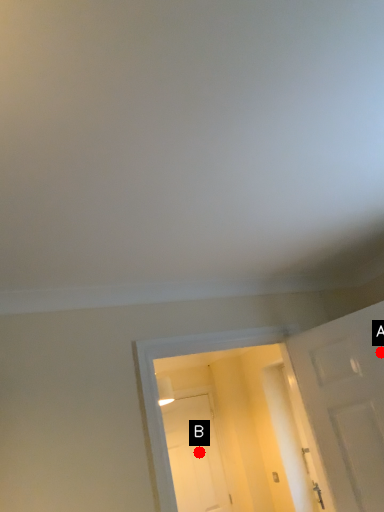
Question: Two points are circled on the image, labeled by A and B beside each circle. Among these points, which one is farthest from the camera?

Choices:
 (A) A is further
 (B) B is further

Answer: (B)